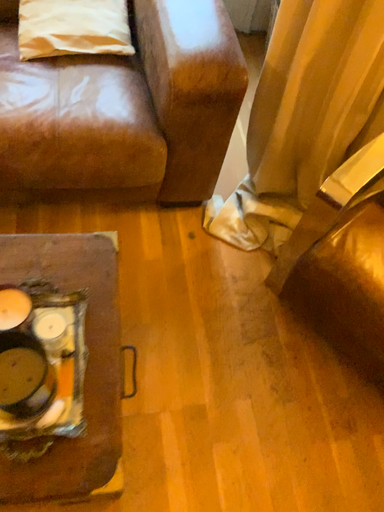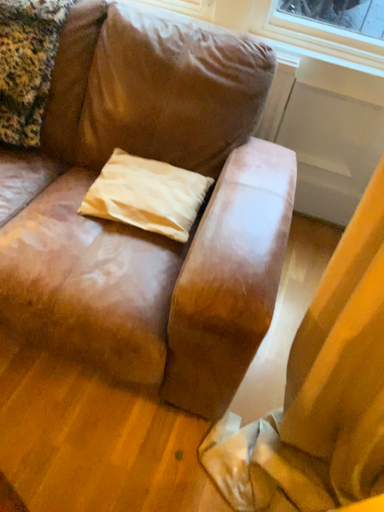
Question: Which way did the camera rotate in the video?

Choices:
 (A) rotated upward
 (B) rotated downward

Answer: (A)